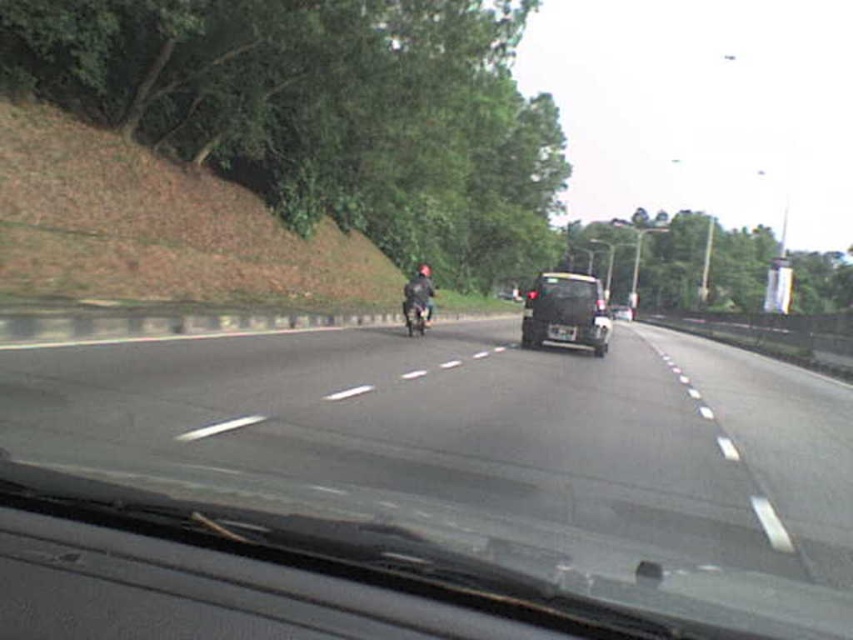
Question: Which of the following is the closest to the observer?

Choices:
 (A) dark gray matte jacket at center
 (B) black matte van at center
 (C) shiny metallic motorcycle at center
 (D) black asphalt road at center

Answer: (D)

Question: Among these objects, which one is nearest to the camera?

Choices:
 (A) black asphalt road at center
 (B) black matte van at center
 (C) dark gray matte jacket at center

Answer: (A)

Question: Which point is farther to the camera?

Choices:
 (A) (422, 298)
 (B) (357, 458)
 (C) (544, 288)
 (D) (415, 310)

Answer: (A)

Question: Does black matte van at center appear over shiny metallic motorcycle at center?

Choices:
 (A) no
 (B) yes

Answer: (A)

Question: Is black asphalt road at center thinner than shiny metallic motorcycle at center?

Choices:
 (A) no
 (B) yes

Answer: (A)

Question: Can you confirm if black asphalt road at center is positioned to the left of black matte van at center?

Choices:
 (A) yes
 (B) no

Answer: (A)